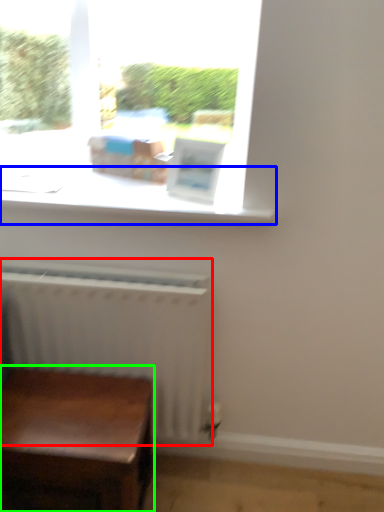
Question: Considering the real-world distances, which object is closest to radiator (highlighted by a red box)? window sill (highlighted by a blue box) or table (highlighted by a green box).

Choices:
 (A) window sill
 (B) table

Answer: (B)